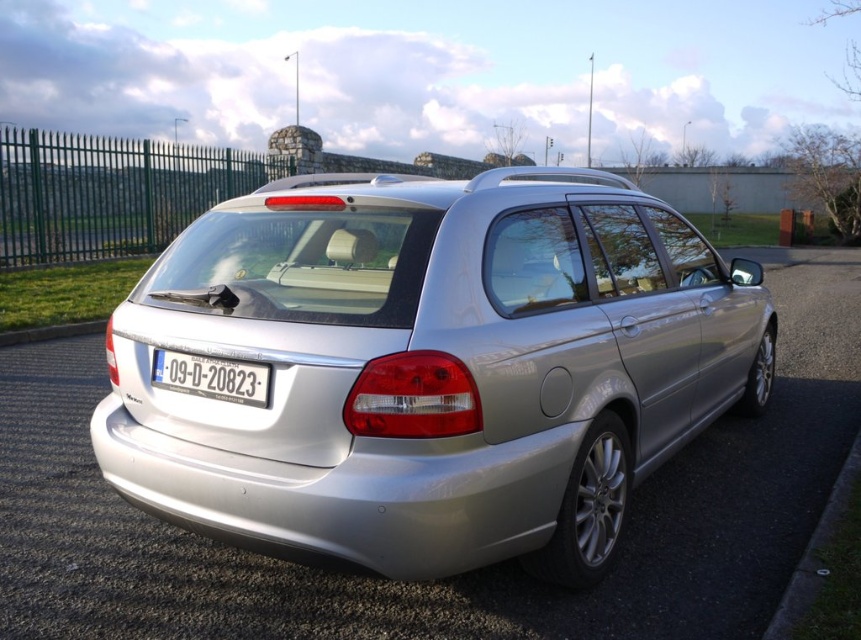
Between silver metallic car at center and black asphalt curb at lower right, which one has less height?

With less height is black asphalt curb at lower right.

Is point (329, 500) positioned after point (846, 481)?

No, (329, 500) is in front of (846, 481).

Find the location of a particular element. The image size is (861, 640). silver metallic car at center is located at coordinates (431, 368).

Which is below, green metal fence at left or white plastic license plate at center?

white plastic license plate at center is lower down.

What do you see at coordinates (110, 192) in the screenshot?
I see `green metal fence at left` at bounding box center [110, 192].

At what (x,y) coordinates should I click in order to perform the action: click on green metal fence at left. Please return your answer as a coordinate pair (x, y). The height and width of the screenshot is (640, 861). Looking at the image, I should click on (110, 192).

Between black asphalt curb at lower right and white plastic license plate at center, which one has less height?

white plastic license plate at center

Consider the image. Who is higher up, black asphalt curb at lower right or white plastic license plate at center?

white plastic license plate at center

Between point (846, 500) and point (255, 369), which one is positioned behind?

The point (846, 500) is behind.

I want to click on black asphalt curb at lower right, so click(815, 552).